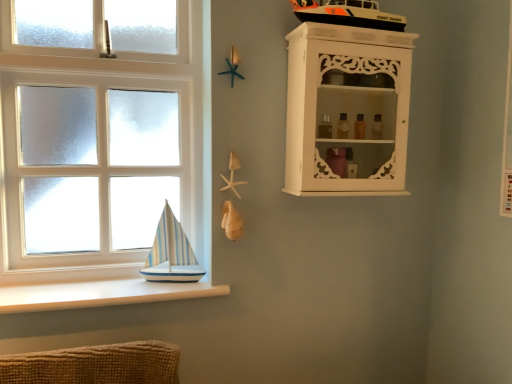
Find the location of a particular element. This screenshot has height=384, width=512. vacant space situated above white smooth ledge at lower left (from a real-world perspective) is located at coordinates (106, 283).